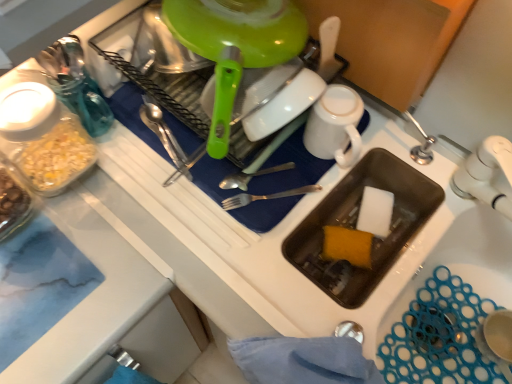
Find the location of `free space to the left of shiny metal spoon at center`. free space to the left of shiny metal spoon at center is located at coordinates (120, 144).